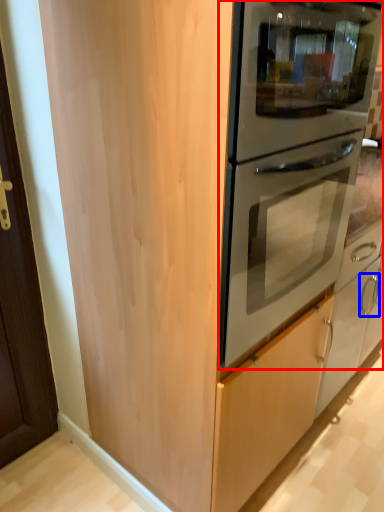
Question: Which object is further to the camera taking this photo, oven (highlighted by a red box) or door handle (highlighted by a blue box)?

Choices:
 (A) oven
 (B) door handle

Answer: (B)